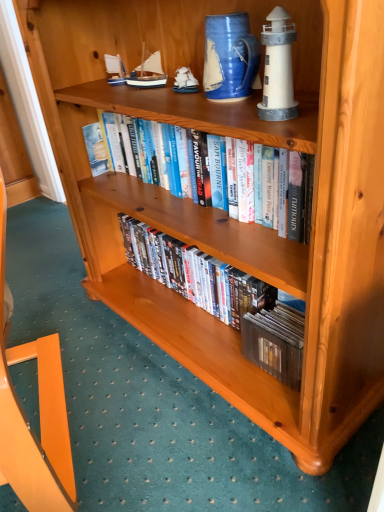
Question: From the image's perspective, is blue painted wood sailboat at upper center, placed as the first toy when sorted from back to front, on matte wooden dvds at center, the 1th book positioned from the bottom?

Choices:
 (A) no
 (B) yes

Answer: (B)

Question: Considering the relative sizes of blue painted wood sailboat at upper center, which ranks as the first toy in left-to-right order, and matte wooden dvds at center, which appears as the 2th book when viewed from the top, in the image provided, is blue painted wood sailboat at upper center, which ranks as the first toy in left-to-right order, taller than matte wooden dvds at center, which appears as the 2th book when viewed from the top,?

Choices:
 (A) yes
 (B) no

Answer: (B)

Question: From a real-world perspective, is blue painted wood sailboat at upper center, which ranks as the third toy in right-to-left order, below matte wooden dvds at center, which appears as the 2th book when viewed from the top?

Choices:
 (A) yes
 (B) no

Answer: (B)

Question: Does blue painted wood sailboat at upper center, acting as the 3th toy starting from the front, touch matte wooden dvds at center, the 1th book positioned from the bottom?

Choices:
 (A) yes
 (B) no

Answer: (B)

Question: Is blue painted wood sailboat at upper center, which ranks as the first toy in left-to-right order, thinner than matte wooden dvds at center, the 1th book positioned from the bottom?

Choices:
 (A) yes
 (B) no

Answer: (A)

Question: Considering the positions of point (180, 67) and point (256, 332), is point (180, 67) closer or farther from the camera than point (256, 332)?

Choices:
 (A) farther
 (B) closer

Answer: (A)

Question: Is wooden ship at upper center, acting as the 2th toy starting from the back, situated inside matte wooden dvds at center, which appears as the 2th book when viewed from the top, or outside?

Choices:
 (A) outside
 (B) inside

Answer: (A)

Question: Considering the positions of wooden ship at upper center, acting as the 2th toy starting from the front, and matte wooden dvds at center, which appears as the 2th book when viewed from the top, in the image, is wooden ship at upper center, acting as the 2th toy starting from the front, wider or thinner than matte wooden dvds at center, which appears as the 2th book when viewed from the top,?

Choices:
 (A) thin
 (B) wide

Answer: (A)

Question: In terms of height, does wooden ship at upper center, acting as the 2th toy starting from the front, look taller or shorter compared to matte wooden dvds at center, which appears as the 2th book when viewed from the top?

Choices:
 (A) tall
 (B) short

Answer: (B)

Question: In the image, is white matte lighthouse at upper right, acting as the third toy starting from the left, on the left side or the right side of blue painted wood sailboat at upper center, which ranks as the first toy in left-to-right order?

Choices:
 (A) right
 (B) left

Answer: (A)

Question: Looking at their shapes, would you say white matte lighthouse at upper right, acting as the third toy starting from the left, is wider or thinner than blue painted wood sailboat at upper center, which ranks as the third toy in right-to-left order?

Choices:
 (A) thin
 (B) wide

Answer: (A)

Question: From the image's perspective, is white matte lighthouse at upper right, acting as the third toy starting from the left, located above or below blue painted wood sailboat at upper center, which ranks as the third toy in right-to-left order?

Choices:
 (A) below
 (B) above

Answer: (A)

Question: Considering the positions of white matte lighthouse at upper right, which is counted as the first toy, starting from the front, and blue painted wood sailboat at upper center, placed as the first toy when sorted from back to front, in the image, is white matte lighthouse at upper right, which is counted as the first toy, starting from the front, taller or shorter than blue painted wood sailboat at upper center, placed as the first toy when sorted from back to front,?

Choices:
 (A) tall
 (B) short

Answer: (A)

Question: From a real-world perspective, is blue painted wood sailboat at upper center, acting as the 3th toy starting from the front, positioned above or below matte wooden dvds at center, which appears as the 2th book when viewed from the top?

Choices:
 (A) below
 (B) above

Answer: (B)

Question: Choose the correct answer: Is blue painted wood sailboat at upper center, which ranks as the first toy in left-to-right order, inside matte wooden dvds at center, which appears as the 2th book when viewed from the top, or outside it?

Choices:
 (A) inside
 (B) outside

Answer: (B)